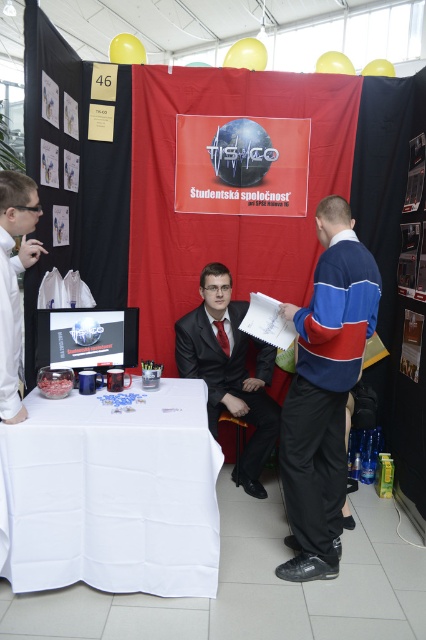
Does white cloth table at lower left lie in front of blue/white/red sweater at center?

Yes, white cloth table at lower left is in front of blue/white/red sweater at center.

Between white cloth table at lower left and blue/white/red sweater at center, which one appears on the right side from the viewer's perspective?

blue/white/red sweater at center

Based on the photo, who is more forward, (x=196, y=403) or (x=302, y=371)?

Point (x=302, y=371) is in front.

This screenshot has width=426, height=640. What are the coordinates of `white cloth table at lower left` in the screenshot? It's located at (114, 492).

Looking at this image, which is more to the right, blue/white/red sweater at center or white glossy shirt at left?

blue/white/red sweater at center

Does blue/white/red sweater at center have a smaller size compared to white glossy shirt at left?

Actually, blue/white/red sweater at center might be larger than white glossy shirt at left.

Between point (293, 444) and point (16, 257), which one is positioned behind?

The point (16, 257) is behind.

In order to click on blue/white/red sweater at center in this screenshot , I will do `click(325, 392)`.

Does white cloth table at lower left appear over matte plastic poster at center?

No.

Is point (169, 380) positioned behind point (207, 140)?

That is False.

Identify the location of white cloth table at lower left. (114, 492).